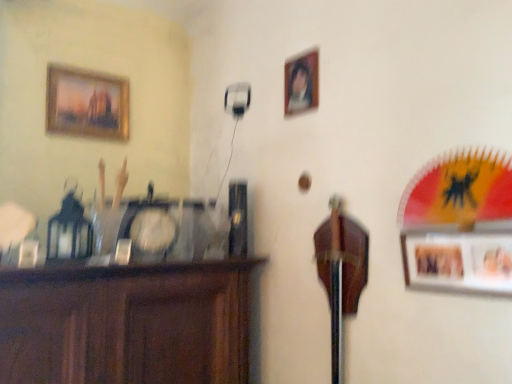
Question: Is wooden portrait frame at upper center, the second picture frame in the back-to-front sequence, in front of or behind brown wood cabinet at left in the image?

Choices:
 (A) front
 (B) behind

Answer: (B)

Question: Looking at the image, does wooden portrait frame at upper center, which is the 2th picture frame in front-to-back order, seem bigger or smaller compared to brown wood cabinet at left?

Choices:
 (A) small
 (B) big

Answer: (A)

Question: Based on their relative distances, which object is farther from the gold-framed painting at upper left, which appears as the third picture frame when viewed from the right?

Choices:
 (A) brown wood cabinet at left
 (B) wooden photo frame at right, the 1th picture frame in the right-to-left sequence
 (C) wooden portrait frame at upper center, the second picture frame in the back-to-front sequence

Answer: (B)

Question: Estimate the real-world distances between objects in this image. Which object is closer to the brown wood cabinet at left?

Choices:
 (A) wooden photo frame at right, which is counted as the third picture frame, starting from the top
 (B) gold-framed painting at upper left, which appears as the third picture frame when viewed from the right
 (C) wooden portrait frame at upper center, marked as the 1th picture frame in a top-to-bottom arrangement

Answer: (A)